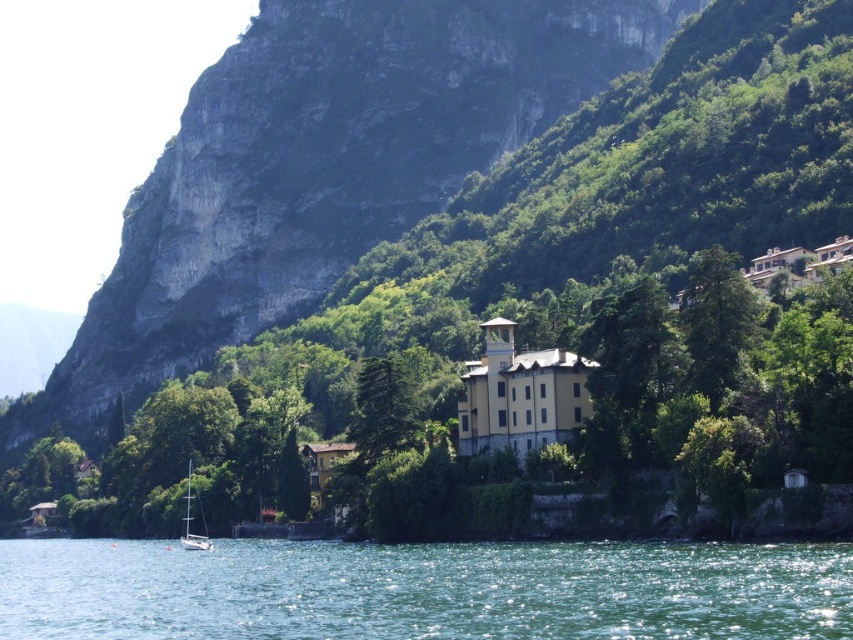
You are standing at the lakeside and see two points marked in the image. Which point is closer to you, point (292, 67) or point (375, 620)?

Point (292, 67) is closer to you because it is further to the viewer than point (375, 620).

You are standing at the lakeside and looking at the two points marked in the image. Which point, point (100, 588) or point (199, 545), is closer to you?

Point (100, 588) is closer to you than point (199, 545).

You are planning to build a small garden on the rocky cliff at upper left and the green liquid water at lower center. Which location would provide more vertical space for tall plants?

The rocky cliff at upper left is taller than the green liquid water at lower center, so it provides more vertical space for tall plants.